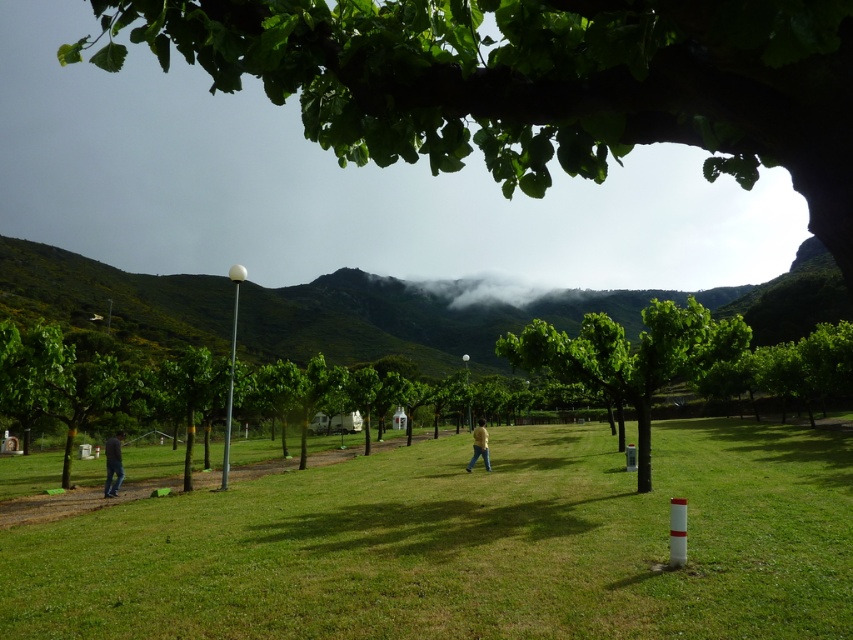
Question: Can you confirm if green grassy field at center is positioned to the left of green leafy tree at upper center?

Choices:
 (A) yes
 (B) no

Answer: (B)

Question: Can you confirm if green grassy field at center is positioned to the right of yellow matte shirt at center?

Choices:
 (A) no
 (B) yes

Answer: (B)

Question: Estimate the real-world distances between objects in this image. Which object is closer to the green leafy tree at upper center?

Choices:
 (A) green grassy field at center
 (B) yellow matte shirt at center
 (C) dark blue jeans at lower left

Answer: (A)

Question: Is green leafy tree at upper center positioned behind dark blue jeans at lower left?

Choices:
 (A) yes
 (B) no

Answer: (B)

Question: Which of the following is the farthest from the observer?

Choices:
 (A) (477, 445)
 (B) (444, 289)
 (C) (103, 35)
 (D) (131, 600)

Answer: (C)

Question: Which point is farther to the camera?

Choices:
 (A) (692, 298)
 (B) (108, 490)

Answer: (A)